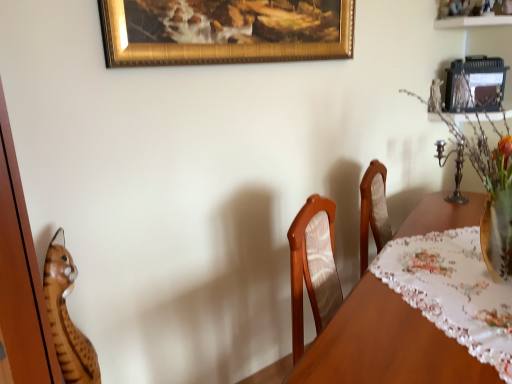
Question: Is wooden tiger at left at the left side of translucent glass vase with colorful flowers at right?

Choices:
 (A) yes
 (B) no

Answer: (A)

Question: Is wooden tiger at left behind translucent glass vase with colorful flowers at right?

Choices:
 (A) yes
 (B) no

Answer: (A)

Question: Is wooden tiger at left bigger than translucent glass vase with colorful flowers at right?

Choices:
 (A) no
 (B) yes

Answer: (A)

Question: From the image's perspective, would you say wooden tiger at left is shown under translucent glass vase with colorful flowers at right?

Choices:
 (A) no
 (B) yes

Answer: (B)

Question: Is wooden tiger at left outside translucent glass vase with colorful flowers at right?

Choices:
 (A) yes
 (B) no

Answer: (A)

Question: Based on their sizes in the image, would you say wooden tiger at left is bigger or smaller than translucent glass vase with colorful flowers at right?

Choices:
 (A) big
 (B) small

Answer: (B)

Question: Is wooden tiger at left spatially inside translucent glass vase with colorful flowers at right, or outside of it?

Choices:
 (A) outside
 (B) inside

Answer: (A)

Question: Is wooden tiger at left to the left or to the right of translucent glass vase with colorful flowers at right in the image?

Choices:
 (A) left
 (B) right

Answer: (A)

Question: From a real-world perspective, is wooden tiger at left positioned above or below translucent glass vase with colorful flowers at right?

Choices:
 (A) above
 (B) below

Answer: (B)

Question: Do you think translucent glass vase with colorful flowers at right is within wooden tiger at left, or outside of it?

Choices:
 (A) inside
 (B) outside

Answer: (B)

Question: Considering the positions of translucent glass vase with colorful flowers at right and wooden tiger at left in the image, is translucent glass vase with colorful flowers at right taller or shorter than wooden tiger at left?

Choices:
 (A) tall
 (B) short

Answer: (A)

Question: In the image, is translucent glass vase with colorful flowers at right on the left side or the right side of wooden tiger at left?

Choices:
 (A) left
 (B) right

Answer: (B)

Question: Based on their sizes in the image, would you say translucent glass vase with colorful flowers at right is bigger or smaller than wooden tiger at left?

Choices:
 (A) big
 (B) small

Answer: (A)

Question: Based on their sizes in the image, would you say gold textured frame at upper center is bigger or smaller than translucent glass vase with colorful flowers at right?

Choices:
 (A) small
 (B) big

Answer: (A)

Question: Do you think gold textured frame at upper center is within translucent glass vase with colorful flowers at right, or outside of it?

Choices:
 (A) inside
 (B) outside

Answer: (B)